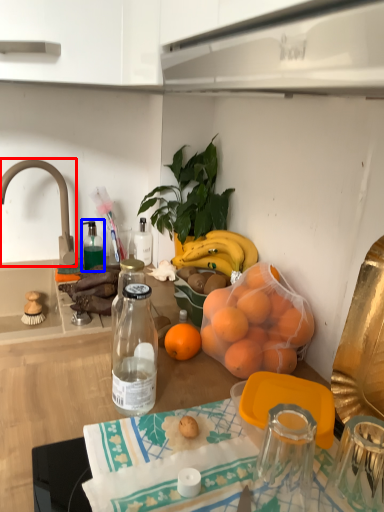
Question: Which point is further to the camera, faucet (highlighted by a red box) or bottle (highlighted by a blue box)?

Choices:
 (A) faucet
 (B) bottle

Answer: (B)